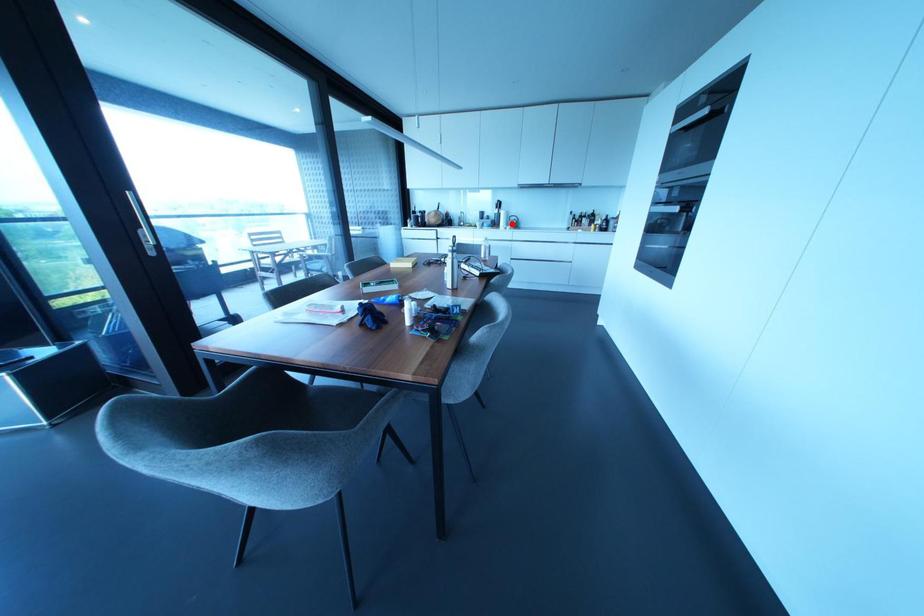
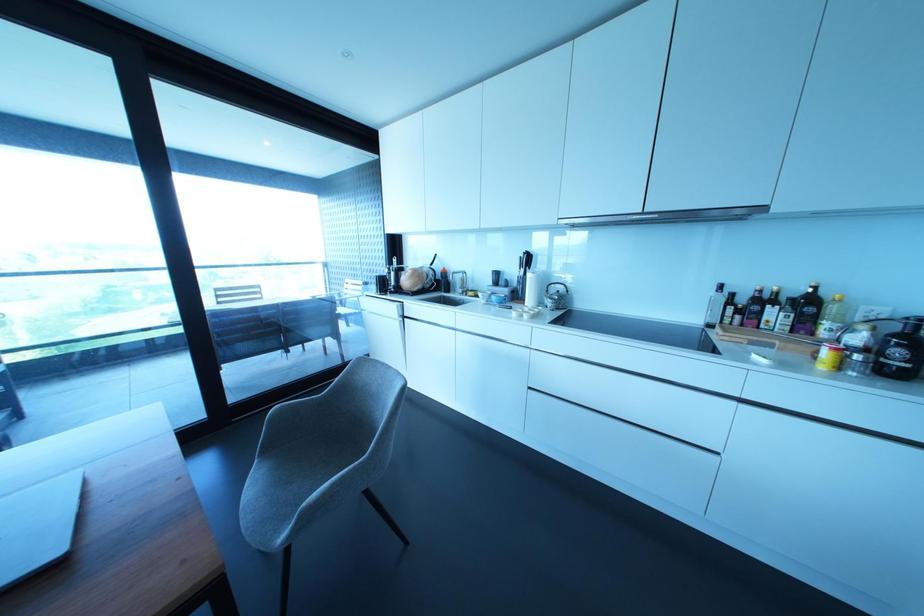
Locate, in the second image, the point that corresponds to the highlighted location in the first image.

(549, 302)